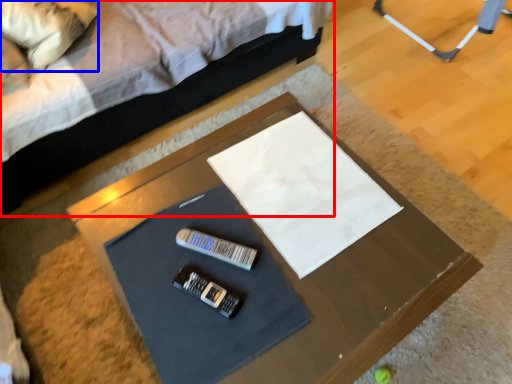
Question: Among these objects, which one is farthest to the camera, bed (highlighted by a red box) or pillow (highlighted by a blue box)?

Choices:
 (A) bed
 (B) pillow

Answer: (B)